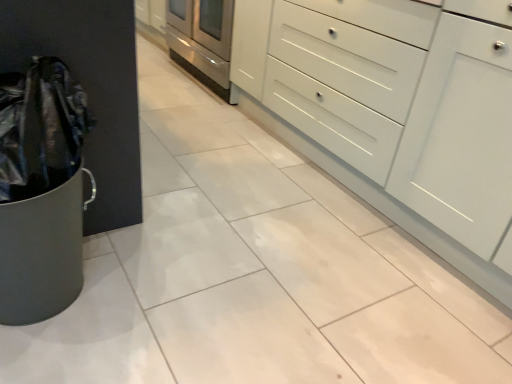
Measure the distance between point (191, 44) and camera.

Point (191, 44) and camera are 3.41 meters apart from each other.

Describe the element at coordinates (202, 40) in the screenshot. I see `stainless steel oven at center` at that location.

You are a GUI agent. You are given a task and a screenshot of the screen. Output one action in this format:
    pyautogui.click(x=<x>, y=<y>)
    Task: Click on the stainless steel oven at center
    This screenshot has height=384, width=512.
    Given the screenshot: What is the action you would take?
    (x=202, y=40)

The height and width of the screenshot is (384, 512). Describe the element at coordinates (394, 112) in the screenshot. I see `white glossy cabinet at center` at that location.

Locate an element on the screen. The height and width of the screenshot is (384, 512). white glossy cabinet at center is located at coordinates (394, 112).

The image size is (512, 384). What are the coordinates of `stainless steel oven at center` in the screenshot? It's located at (202, 40).

Considering the positions of objects stainless steel oven at center and white glossy cabinet at center in the image provided, who is more to the right, stainless steel oven at center or white glossy cabinet at center?

From the viewer's perspective, white glossy cabinet at center appears more on the right side.

Looking at this image, is stainless steel oven at center closer to camera compared to white glossy cabinet at center?

No, it is not.

Is point (226, 19) farther from camera compared to point (357, 188)?

Yes, it is.

From the image's perspective, would you say stainless steel oven at center is shown under white glossy cabinet at center?

Actually, stainless steel oven at center appears above white glossy cabinet at center in the image.

From a real-world perspective, relative to white glossy cabinet at center, is stainless steel oven at center vertically above or below?

From a real-world perspective, stainless steel oven at center is physically below white glossy cabinet at center.

Which object is thinner, stainless steel oven at center or white glossy cabinet at center?

Thinner between the two is white glossy cabinet at center.

Is stainless steel oven at center taller than white glossy cabinet at center?

In fact, stainless steel oven at center may be shorter than white glossy cabinet at center.

Considering the sizes of stainless steel oven at center and white glossy cabinet at center in the image, is stainless steel oven at center bigger or smaller than white glossy cabinet at center?

In the image, stainless steel oven at center appears to be smaller than white glossy cabinet at center.

Would you say white glossy cabinet at center is part of stainless steel oven at center's contents?

No, stainless steel oven at center does not contain white glossy cabinet at center.

Are stainless steel oven at center and white glossy cabinet at center beside each other?

They are not placed beside each other.

Is stainless steel oven at center oriented away from white glossy cabinet at center?

stainless steel oven at center is not turned away from white glossy cabinet at center.

How much distance is there between stainless steel oven at center and white glossy cabinet at center?

stainless steel oven at center and white glossy cabinet at center are 4.11 feet apart from each other.

Where is `oven lying on the left of white glossy cabinet at center`? The height and width of the screenshot is (384, 512). oven lying on the left of white glossy cabinet at center is located at coordinates (202, 40).

Which object is positioned more to the left, white glossy cabinet at center or stainless steel oven at center?

stainless steel oven at center.

Relative to stainless steel oven at center, is white glossy cabinet at center in front or behind?

Visually, white glossy cabinet at center is located in front of stainless steel oven at center.

Which is behind, point (417, 123) or point (182, 4)?

Positioned behind is point (182, 4).

From the image's perspective, is white glossy cabinet at center above stainless steel oven at center?

No, from the image's perspective, white glossy cabinet at center is not over stainless steel oven at center.

From a real-world perspective, relative to stainless steel oven at center, is white glossy cabinet at center vertically above or below?

white glossy cabinet at center is above stainless steel oven at center.

Is white glossy cabinet at center thinner than stainless steel oven at center?

Yes.

Considering the sizes of objects white glossy cabinet at center and stainless steel oven at center in the image provided, who is shorter, white glossy cabinet at center or stainless steel oven at center?

With less height is stainless steel oven at center.

Does white glossy cabinet at center have a smaller size compared to stainless steel oven at center?

Actually, white glossy cabinet at center might be larger than stainless steel oven at center.

Is white glossy cabinet at center surrounding stainless steel oven at center?

No, white glossy cabinet at center does not contain stainless steel oven at center.

Is white glossy cabinet at center not near stainless steel oven at center?

white glossy cabinet at center is positioned a significant distance from stainless steel oven at center.

Is stainless steel oven at center at the back of white glossy cabinet at center?

No, white glossy cabinet at center is not facing the opposite direction of stainless steel oven at center.

Locate an element on the screen. The height and width of the screenshot is (384, 512). chest of drawers in front of the stainless steel oven at center is located at coordinates (394, 112).

Locate an element on the screen. chest of drawers on the right of stainless steel oven at center is located at coordinates (394, 112).

I want to click on the chest of drawers that appears below the stainless steel oven at center (from the image's perspective), so click(x=394, y=112).